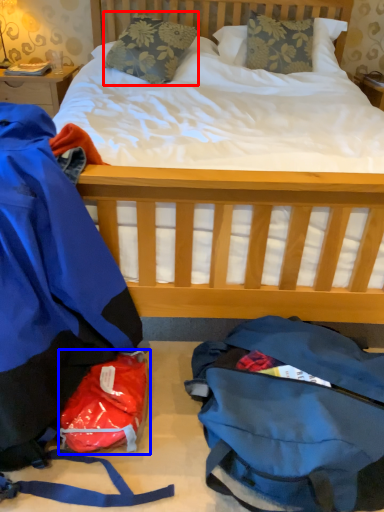
Question: Among these objects, which one is nearest to the camera, pillow (highlighted by a red box) or diaper bag (highlighted by a blue box)?

Choices:
 (A) pillow
 (B) diaper bag

Answer: (B)